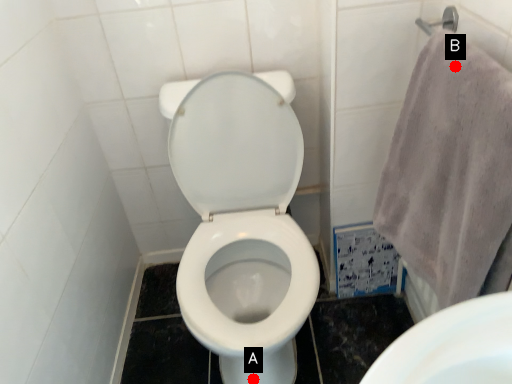
Question: Two points are circled on the image, labeled by A and B beside each circle. Which point is further to the camera?

Choices:
 (A) A is further
 (B) B is further

Answer: (A)